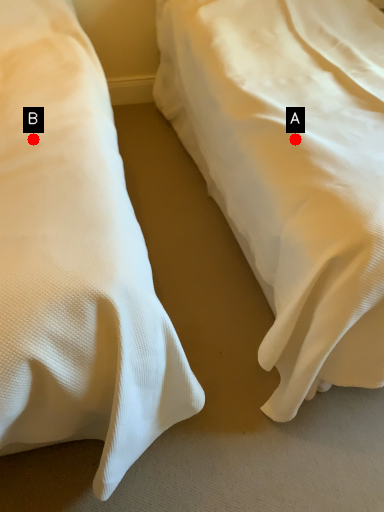
Question: Two points are circled on the image, labeled by A and B beside each circle. Which point appears closest to the camera in this image?

Choices:
 (A) A is closer
 (B) B is closer

Answer: (B)